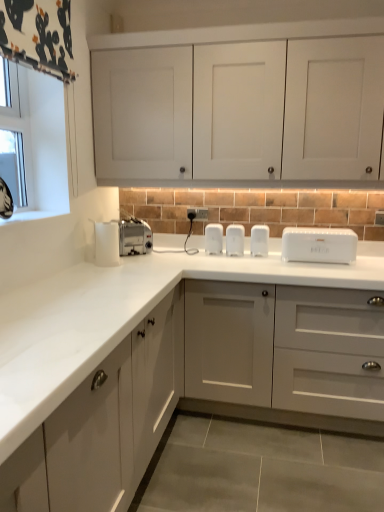
Question: Based on their positions, is white plastic bread bin at center located to the left or right of clear glass window at upper left?

Choices:
 (A) right
 (B) left

Answer: (A)

Question: Does point tap(286, 260) appear closer or farther from the camera than point tap(23, 208)?

Choices:
 (A) farther
 (B) closer

Answer: (A)

Question: Based on their relative distances, which object is nearer to the white plastic toaster at center, which is the 1th appliance from right to left?

Choices:
 (A) white matte cabinet doors at upper center, positioned as the 2th cabinetry in bottom-to-top order
 (B) silver metallic toaster at center
 (C) matte white cabinet at center, which appears as the first cabinetry when ordered from the bottom
 (D) clear glass window at upper left
 (E) white glossy window sill at upper left

Answer: (C)

Question: Based on their relative distances, which object is nearer to the clear glass window at upper left?

Choices:
 (A) white plastic bread bin at center
 (B) white glossy window sill at upper left
 (C) white plastic toaster at center, the 2th appliance positioned from the left
 (D) silver metallic toaster at center
 (E) white matte cabinet doors at upper center, positioned as the 2th cabinetry in bottom-to-top order

Answer: (B)